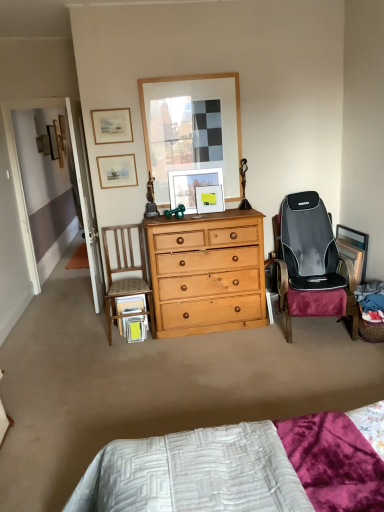
Question: Is matte wooden picture frame at center, which appears as the 5th picture frame when viewed from the top, next to wooden picture frame at upper left, arranged as the sixth picture frame when ordered from the bottom, and touching it?

Choices:
 (A) yes
 (B) no

Answer: (B)

Question: Does matte wooden picture frame at center, which ranks as the fourth picture frame in back-to-front order, come behind wooden picture frame at upper left, which is the second picture frame in left-to-right order?

Choices:
 (A) no
 (B) yes

Answer: (A)

Question: Is matte wooden picture frame at center, placed as the fifth picture frame when sorted from left to right, not inside wooden picture frame at upper left, which is the second picture frame in left-to-right order?

Choices:
 (A) yes
 (B) no

Answer: (A)

Question: Is wooden picture frame at upper left, the 6th picture frame from the right, located within matte wooden picture frame at center, which ranks as the fourth picture frame in back-to-front order?

Choices:
 (A) yes
 (B) no

Answer: (B)

Question: Is matte wooden picture frame at center, positioned as the fourth picture frame in front-to-back order, at the left side of wooden picture frame at upper left, which is the second picture frame in left-to-right order?

Choices:
 (A) yes
 (B) no

Answer: (B)

Question: From the image's perspective, does matte wooden picture frame at center, marked as the third picture frame in a bottom-to-top arrangement, appear higher than wooden picture frame at upper left, which is the second picture frame in left-to-right order?

Choices:
 (A) no
 (B) yes

Answer: (A)

Question: Does wooden picture frame at upper left, arranged as the sixth picture frame when ordered from the bottom, have a lesser width compared to wooden picture frame at upper left, placed as the seventh picture frame when sorted from right to left?

Choices:
 (A) no
 (B) yes

Answer: (B)

Question: Is wooden picture frame at upper left, the 6th picture frame from the right, shorter than wooden picture frame at upper left, which appears as the 1th picture frame when viewed from the back?

Choices:
 (A) no
 (B) yes

Answer: (A)

Question: Does wooden picture frame at upper left, acting as the second picture frame starting from the back, come in front of wooden picture frame at upper left, placed as the seventh picture frame when sorted from right to left?

Choices:
 (A) yes
 (B) no

Answer: (A)

Question: Does wooden picture frame at upper left, which is the second picture frame in left-to-right order, have a greater width compared to wooden picture frame at upper left, positioned as the first picture frame in left-to-right order?

Choices:
 (A) no
 (B) yes

Answer: (A)

Question: Does wooden picture frame at upper left, which is the second picture frame in left-to-right order, appear on the left side of wooden picture frame at upper left, which is the 7th picture frame in bottom-to-top order?

Choices:
 (A) yes
 (B) no

Answer: (B)

Question: Would you say wooden picture frame at upper left, the 2th picture frame from the top, contains wooden picture frame at upper left, positioned as the first picture frame in left-to-right order?

Choices:
 (A) no
 (B) yes

Answer: (A)

Question: Considering the relative sizes of matte wooden picture frame at upper left, acting as the 6th picture frame starting from the back, and matte wooden picture frame at center, which ranks as the fourth picture frame in back-to-front order, in the image provided, is matte wooden picture frame at upper left, acting as the 6th picture frame starting from the back, shorter than matte wooden picture frame at center, which ranks as the fourth picture frame in back-to-front order,?

Choices:
 (A) yes
 (B) no

Answer: (A)